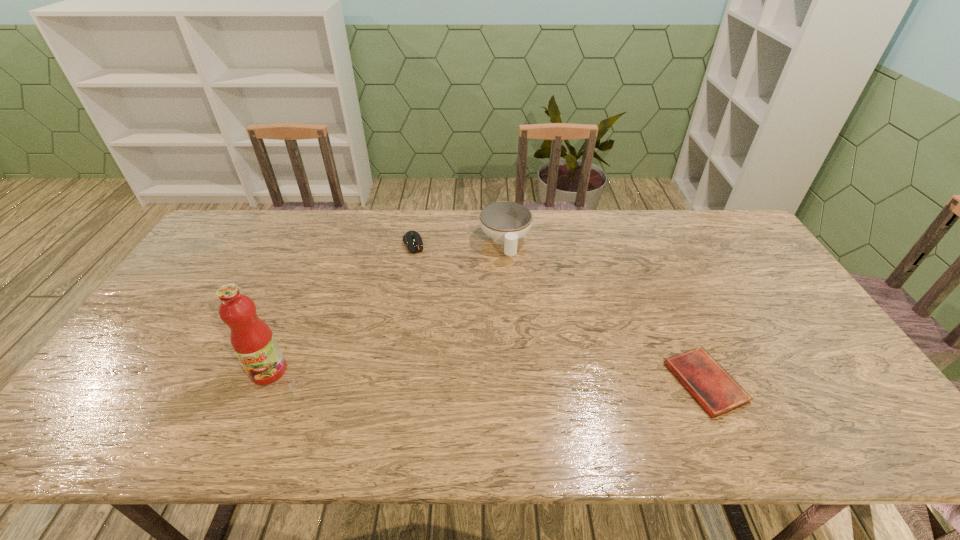
The width and height of the screenshot is (960, 540). I want to click on vacant space situated on the button of the computer equipment, so click(x=420, y=269).

I want to click on vacant area situated on the button of the computer equipment, so click(x=433, y=306).

Where is `free spot located 0.300m on the side with the handle of the chinaware`? The width and height of the screenshot is (960, 540). free spot located 0.300m on the side with the handle of the chinaware is located at coordinates (525, 334).

At what (x,y) coordinates should I click in order to perform the action: click on free location located on the side with the handle of the chinaware. Please return your answer as a coordinate pair (x, y). The width and height of the screenshot is (960, 540). Looking at the image, I should click on (527, 343).

Where is `blank space located 0.090m on the side with the handle of the chinaware`? The image size is (960, 540). blank space located 0.090m on the side with the handle of the chinaware is located at coordinates (514, 282).

I want to click on computer equipment present at the far edge, so click(413, 240).

At what (x,y) coordinates should I click in order to perform the action: click on chinaware located in the far edge section of the desktop. Please return your answer as a coordinate pair (x, y). Looking at the image, I should click on (506, 222).

Locate an element on the screen. The width and height of the screenshot is (960, 540). fruit juice that is at the near edge is located at coordinates (252, 340).

This screenshot has width=960, height=540. In order to click on diary that is at the near edge in this screenshot , I will do `click(709, 383)`.

Find the location of a particular element. The width and height of the screenshot is (960, 540). vacant position at the far edge of the desktop is located at coordinates (550, 237).